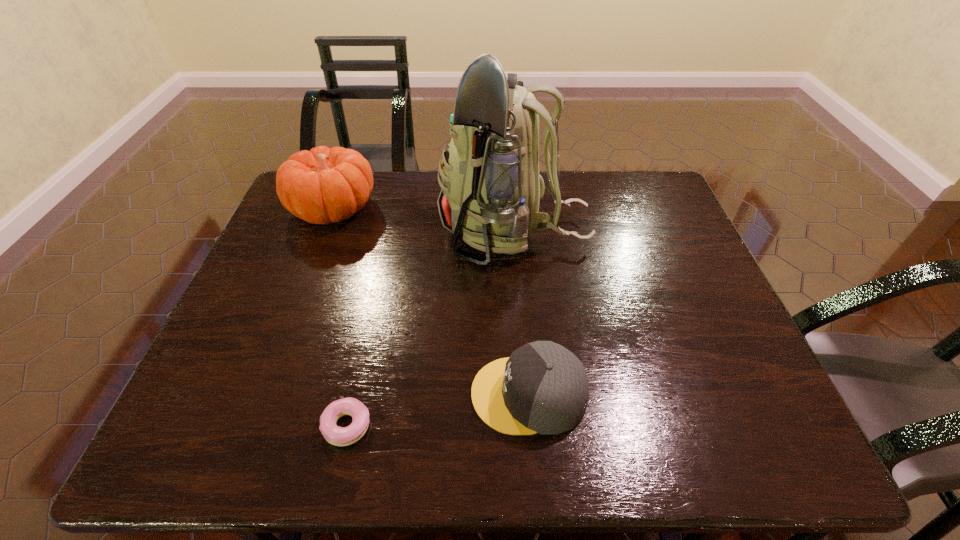
This screenshot has height=540, width=960. In order to click on blank space located on the front-facing side of the cap in this screenshot , I will do `click(289, 394)`.

Image resolution: width=960 pixels, height=540 pixels. I want to click on vacant area located on the front-facing side of the cap, so click(x=347, y=394).

Where is `free space located on the front-facing side of the cap`? The image size is (960, 540). free space located on the front-facing side of the cap is located at coordinates tap(447, 394).

Find the location of `free space located on the right of the shortest object`. free space located on the right of the shortest object is located at coordinates (544, 426).

At what (x,y) coordinates should I click in order to perform the action: click on backpack at the far edge. Please return your answer as a coordinate pair (x, y). The width and height of the screenshot is (960, 540). Looking at the image, I should click on (490, 184).

Locate an element on the screen. pumpkin at the far edge is located at coordinates (323, 185).

The width and height of the screenshot is (960, 540). In order to click on cap that is at the near edge in this screenshot , I will do `click(543, 388)`.

Locate an element on the screen. The image size is (960, 540). doughnut present at the near edge is located at coordinates tap(339, 436).

Where is `object that is at the left edge`? This screenshot has height=540, width=960. object that is at the left edge is located at coordinates (323, 185).

Locate an element on the screen. object that is at the far left corner is located at coordinates (323, 185).